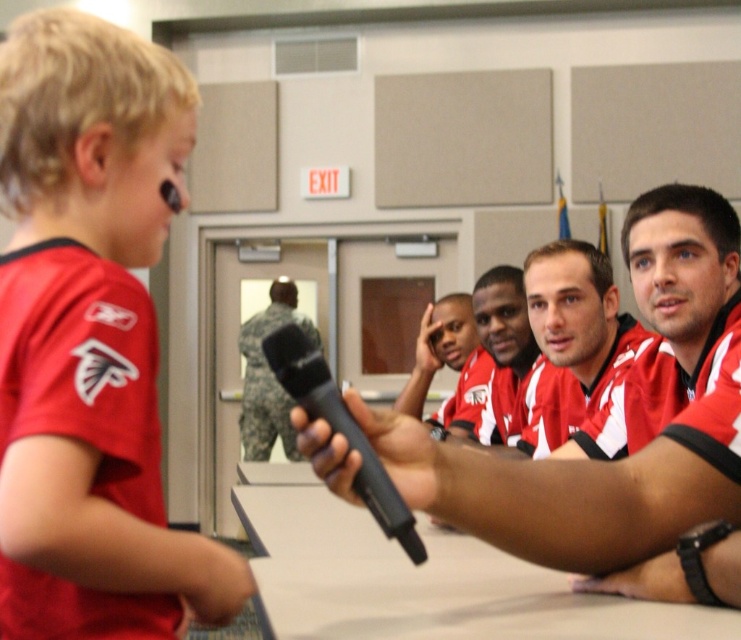
Is matte red jersey at left wider than camouflage uniform at center?

No, matte red jersey at left is not wider than camouflage uniform at center.

Can you confirm if matte red jersey at left is shorter than camouflage uniform at center?

Correct, matte red jersey at left is not as tall as camouflage uniform at center.

Identify the location of matte red jersey at left. (90, 339).

Between matte black microphone at center and black matte microphone at upper center, which one appears on the left side from the viewer's perspective?

black matte microphone at upper center is more to the left.

Does point (625, 531) come in front of point (167, 188)?

That is False.

In order to click on matte black microphone at center in this screenshot , I will do `click(625, 433)`.

In the scene shown: Who is shorter, matte jersey at center or camouflage uniform at center?

Standing shorter between the two is matte jersey at center.

Is point (554, 412) closer to viewer compared to point (265, 404)?

Yes.

Is point (571, 292) farther from viewer compared to point (292, 401)?

No, (571, 292) is closer to viewer.

Identify the location of matte jersey at center. Image resolution: width=741 pixels, height=640 pixels. 574,333.